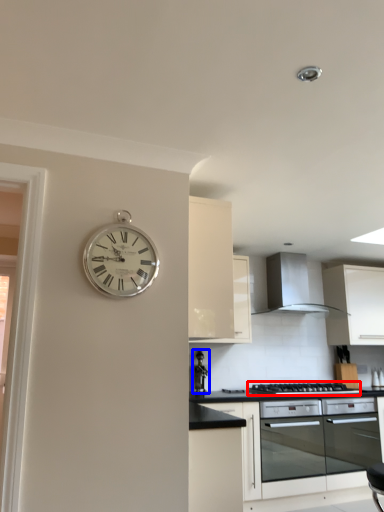
Question: Which of the following is the closest to the observer, gas stove (highlighted by a red box) or appliance (highlighted by a blue box)?

Choices:
 (A) gas stove
 (B) appliance

Answer: (A)